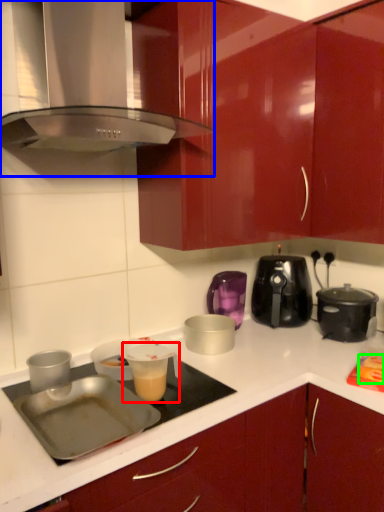
Question: Which is nearer to the appliance (highlighted by a red box)? home appliance (highlighted by a blue box) or food (highlighted by a green box).

Choices:
 (A) home appliance
 (B) food

Answer: (B)